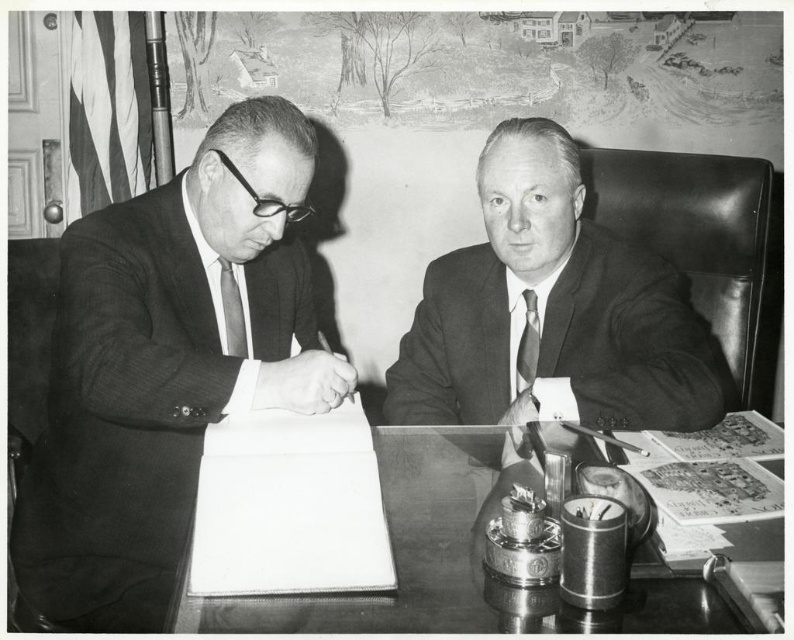
Is shiny metal desk at center bigger than striped fabric tie at left?

Correct, shiny metal desk at center is larger in size than striped fabric tie at left.

Where is `shiny metal desk at center`? shiny metal desk at center is located at coordinates (405, 548).

Who is more forward, (x=326, y=611) or (x=234, y=346)?

Positioned in front is point (x=326, y=611).

Where is `shiny metal desk at center`? shiny metal desk at center is located at coordinates (405, 548).

Who is taller, smooth black suit at center or striped fabric tie at center?

smooth black suit at center

Is smooth black suit at center wider than striped fabric tie at center?

Yes, smooth black suit at center is wider than striped fabric tie at center.

At what (x,y) coordinates should I click in order to perform the action: click on smooth black suit at center. Please return your answer as a coordinate pair (x, y). The height and width of the screenshot is (640, 794). Looking at the image, I should click on (553, 310).

Which is in front, point (198, 317) or point (222, 285)?

Point (198, 317) is in front.

How far apart are smooth suit jacket at left and striped fabric tie at left?

A distance of 8.27 inches exists between smooth suit jacket at left and striped fabric tie at left.

Is point (152, 332) farther from camera compared to point (241, 323)?

No.

Find the location of `smooth suit jacket at left`. smooth suit jacket at left is located at coordinates (166, 365).